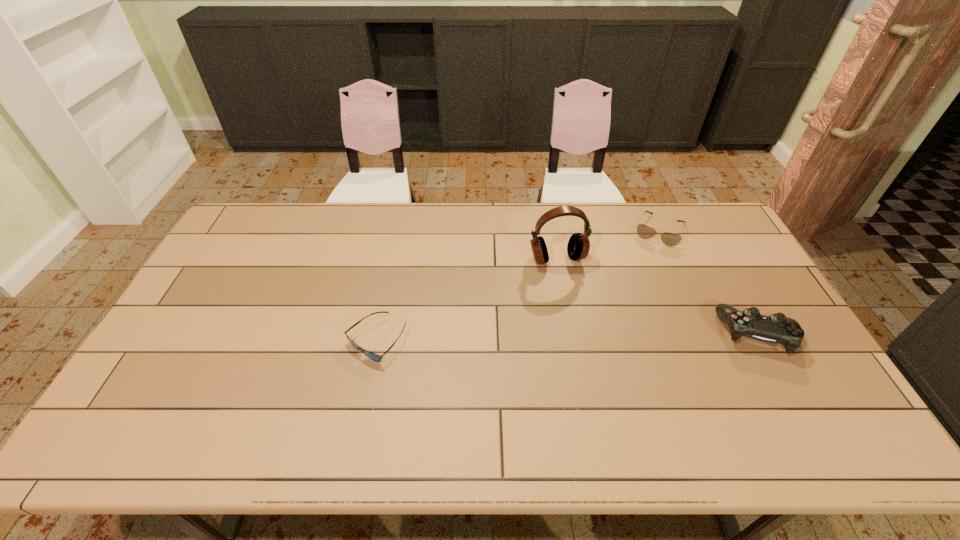
Locate an element on the screen. The height and width of the screenshot is (540, 960). free spot on the desktop that is between the shorter sunglasses and the third shortest object and is positioned on the ear pads of the third object from right to left is located at coordinates (587, 336).

Where is `vacant space on the desktop that is between the shorter sunglasses and the control and is positioned on the front-facing side of the second shortest object`? vacant space on the desktop that is between the shorter sunglasses and the control and is positioned on the front-facing side of the second shortest object is located at coordinates (617, 336).